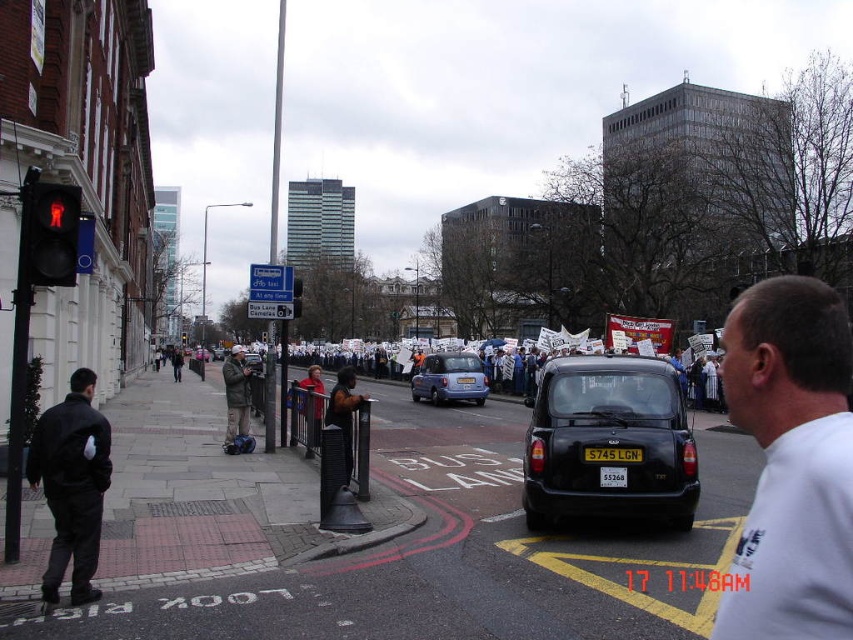
Question: Which of the following is the closest to the observer?

Choices:
 (A) (39, 205)
 (B) (181, 336)

Answer: (A)

Question: Which point is closer to the camera taking this photo?

Choices:
 (A) (468, 394)
 (B) (616, 484)

Answer: (B)

Question: Is red glass pedestrian signal at upper left to the right of matte blue car at center from the viewer's perspective?

Choices:
 (A) no
 (B) yes

Answer: (A)

Question: Which of the following is the closest to the observer?

Choices:
 (A) black leather jacket at left
 (B) matte black taxi at center

Answer: (A)

Question: Considering the relative positions of yellow matte license plate at center and red glass traffic light at upper left in the image provided, where is yellow matte license plate at center located with respect to red glass traffic light at upper left?

Choices:
 (A) left
 (B) right

Answer: (B)

Question: Does matte blue car at center appear on the left side of black plastic license plate at center?

Choices:
 (A) yes
 (B) no

Answer: (A)